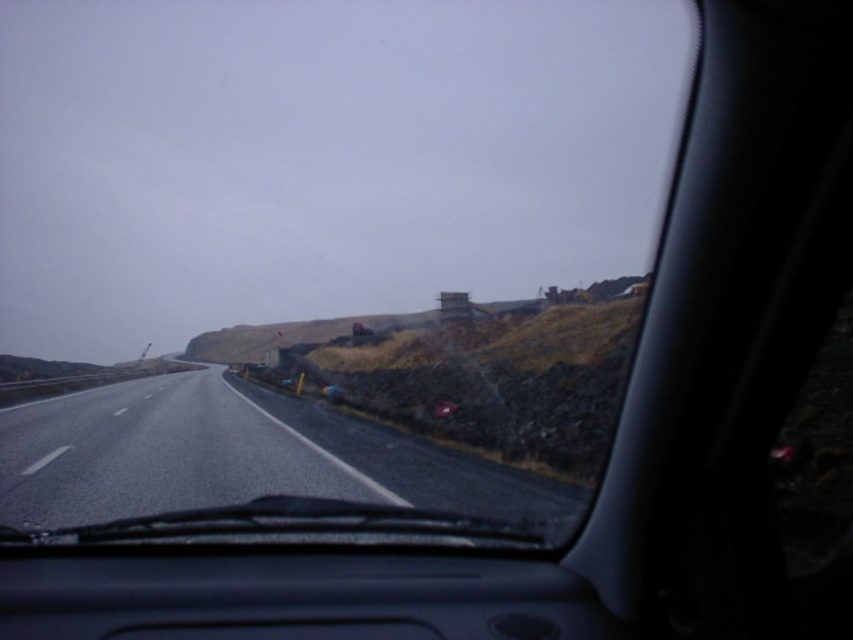
Is transparent glass windshield at center bigger than black asphalt highway at center?

Yes, transparent glass windshield at center is bigger than black asphalt highway at center.

Is point (80, 497) positioned before point (12, 413)?

Yes, point (80, 497) is in front of point (12, 413).

This screenshot has height=640, width=853. What do you see at coordinates (328, 248) in the screenshot? I see `transparent glass windshield at center` at bounding box center [328, 248].

Where is `transparent glass windshield at center`? The image size is (853, 640). transparent glass windshield at center is located at coordinates (328, 248).